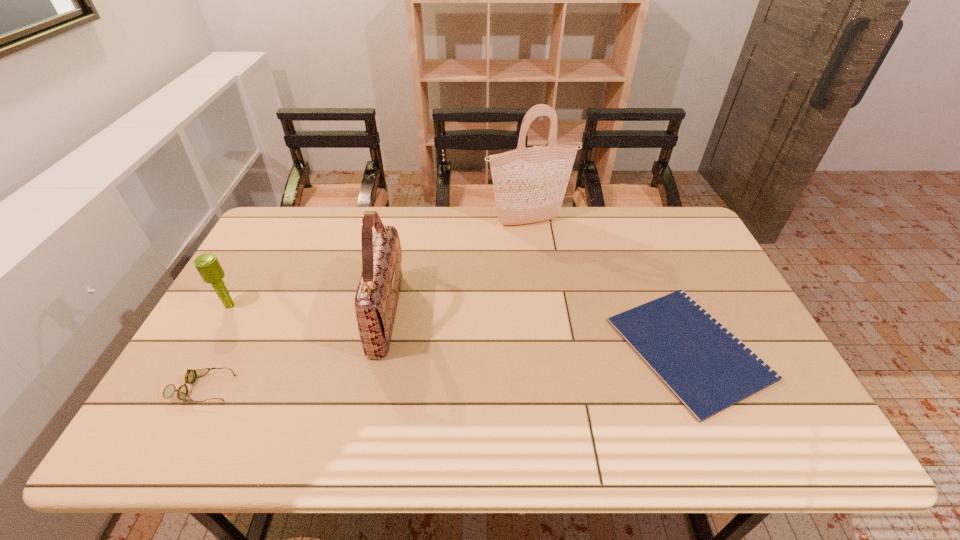
This screenshot has height=540, width=960. In order to click on shopping bag in this screenshot , I will do `click(529, 184)`.

Locate an element on the screen. the farthest object is located at coordinates (529, 184).

Where is `the third object from left to right`? The width and height of the screenshot is (960, 540). the third object from left to right is located at coordinates click(376, 300).

The image size is (960, 540). Identify the location of handbag. (376, 300).

Locate an element on the screen. microphone is located at coordinates (208, 266).

Locate an element on the screen. the second shortest object is located at coordinates (191, 375).

Identify the location of the shortest object. The width and height of the screenshot is (960, 540). (706, 367).

Find the location of a particular element. The width and height of the screenshot is (960, 540). the rightmost object is located at coordinates (706, 367).

Where is `vacant space located 0.280m on the right of the shopping bag`? vacant space located 0.280m on the right of the shopping bag is located at coordinates click(x=650, y=221).

Locate an element on the screen. This screenshot has width=960, height=540. vacant area located on the front of the fourth shortest object with the clasp is located at coordinates (500, 314).